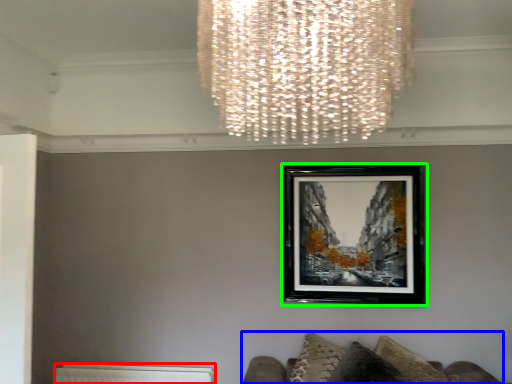
Question: Considering the real-world distances, which object is closest to radiator (highlighted by a red box)? furniture (highlighted by a blue box) or picture frame (highlighted by a green box).

Choices:
 (A) furniture
 (B) picture frame

Answer: (A)